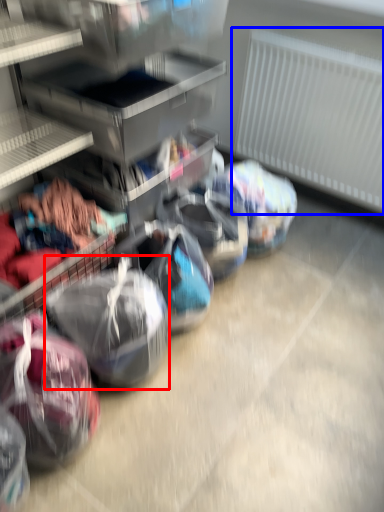
Question: Which object is closer to the camera taking this photo, sack (highlighted by a red box) or radiator (highlighted by a blue box)?

Choices:
 (A) sack
 (B) radiator

Answer: (A)